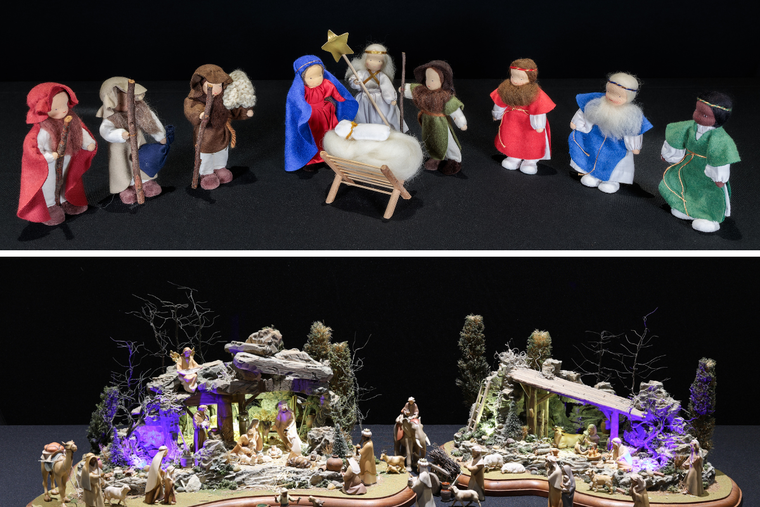
Find the location of a particular element. This screenshot has height=507, width=760. white bar is located at coordinates (84, 252), (407, 255), (640, 255).